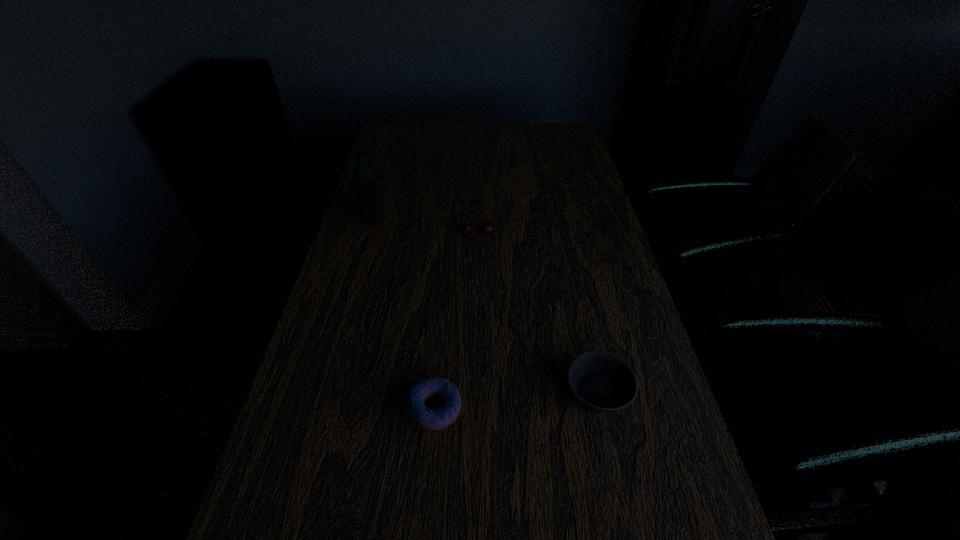
The width and height of the screenshot is (960, 540). I want to click on empty space that is in between the farthest object and the doughnut, so click(404, 315).

At what (x,y) coordinates should I click in order to perform the action: click on free spot between the doughnut and the bowl. Please return your answer as a coordinate pair (x, y). This screenshot has width=960, height=540. Looking at the image, I should click on (516, 400).

Find the location of a particular element. This screenshot has height=540, width=960. vacant area that lies between the third shortest object and the rightmost object is located at coordinates (538, 313).

Find the location of `vacant point located between the bowl and the second tallest object`. vacant point located between the bowl and the second tallest object is located at coordinates (538, 313).

You are a GUI agent. You are given a task and a screenshot of the screen. Output one action in this format:
    pyautogui.click(x=<x>, y=<y>)
    Task: Click on the vacant area that lies between the doughnut and the water bottle
    The image size is (960, 540).
    Given the screenshot: What is the action you would take?
    pyautogui.click(x=404, y=315)

Where is `vacant point located between the bowl and the leftmost object`? The image size is (960, 540). vacant point located between the bowl and the leftmost object is located at coordinates (486, 306).

The width and height of the screenshot is (960, 540). I want to click on object that stands as the closest to the water bottle, so click(x=487, y=228).

Identify which object is the third closest to the doughnut. Please provide its 2D coordinates. Your answer should be formatted as a tuple, i.e. [(x, y)], where the tuple contains the x and y coordinates of a point satisfying the conditions above.

[(365, 176)]

The width and height of the screenshot is (960, 540). I want to click on free location that satisfies the following two spatial constraints: 1. with stems pointing upwards on the rightmost object; 2. on the right side of the cherry, so click(476, 392).

This screenshot has height=540, width=960. I want to click on free space that satisfies the following two spatial constraints: 1. with stems pointing upwards on the cherry; 2. on the right side of the bowl, so click(x=476, y=392).